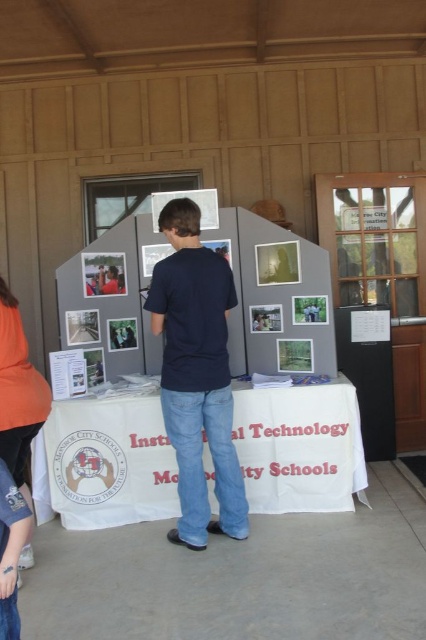
Question: Based on their relative distances, which object is farther from the orange fabric at lower left?

Choices:
 (A) matte gray posterboard at center
 (B) dark blue t-shirt at center
 (C) white cloth at center

Answer: (A)

Question: Which point is closer to the camera taking this photo?

Choices:
 (A) (199, 515)
 (B) (354, 483)
 (C) (36, 401)

Answer: (C)

Question: Does matte gray posterboard at center have a greater width compared to dark blue t-shirt at center?

Choices:
 (A) no
 (B) yes

Answer: (B)

Question: In this image, where is white cloth at center located relative to dark blue t-shirt at center?

Choices:
 (A) left
 (B) right

Answer: (A)

Question: Among these objects, which one is farthest from the camera?

Choices:
 (A) orange fabric at lower left
 (B) dark blue t-shirt at center
 (C) white cloth at center
 (D) matte gray posterboard at center

Answer: (D)

Question: Is white cloth at center further to the viewer compared to orange fabric at lower left?

Choices:
 (A) yes
 (B) no

Answer: (A)